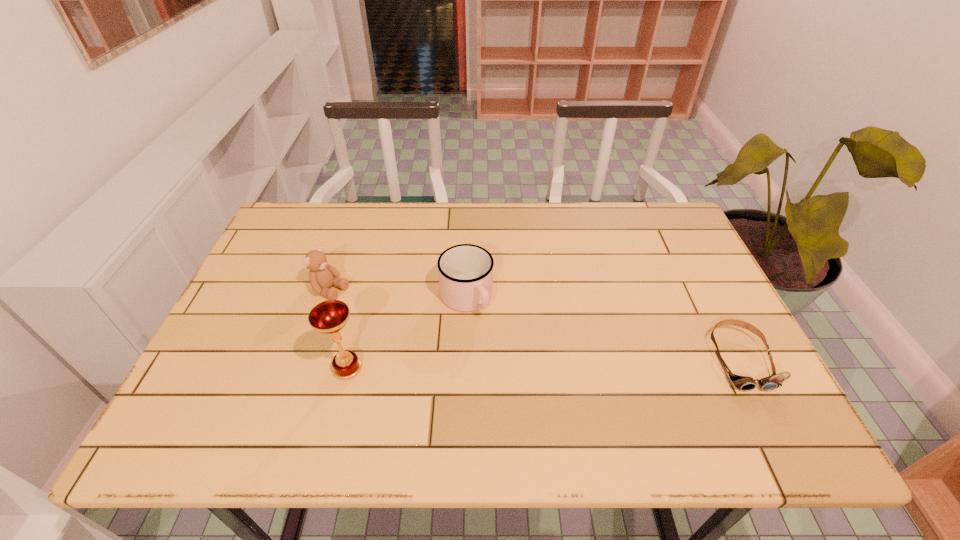
Locate an element on the screen. The image size is (960, 540). object identified as the closest to the rightmost object is located at coordinates (465, 271).

I want to click on vacant point that satisfies the following two spatial constraints: 1. on the front side of the leftmost object; 2. on the left side of the second object from right to left, so click(x=328, y=299).

This screenshot has height=540, width=960. I want to click on vacant position in the image that satisfies the following two spatial constraints: 1. on the front side of the mug; 2. on the right side of the teddy bear, so click(328, 299).